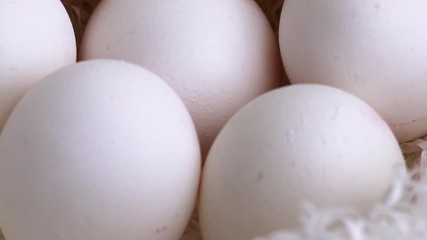
Locate an element on the screen. Image resolution: width=427 pixels, height=240 pixels. brown shade is located at coordinates (272, 67).